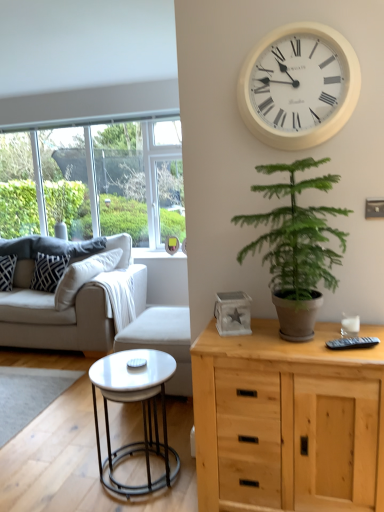
What are the coordinates of `free spot to the left of black plastic remote at right` in the screenshot? It's located at (304, 349).